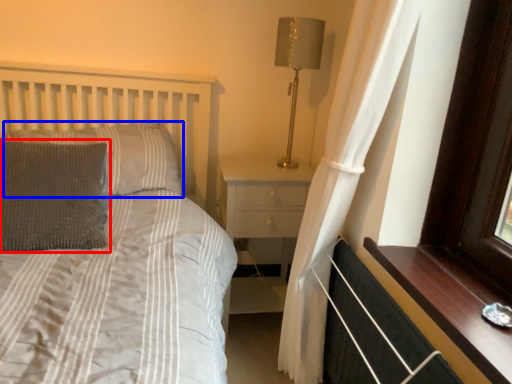
Question: Among these objects, which one is farthest to the camera, pillow (highlighted by a red box) or pillow (highlighted by a blue box)?

Choices:
 (A) pillow
 (B) pillow

Answer: (B)